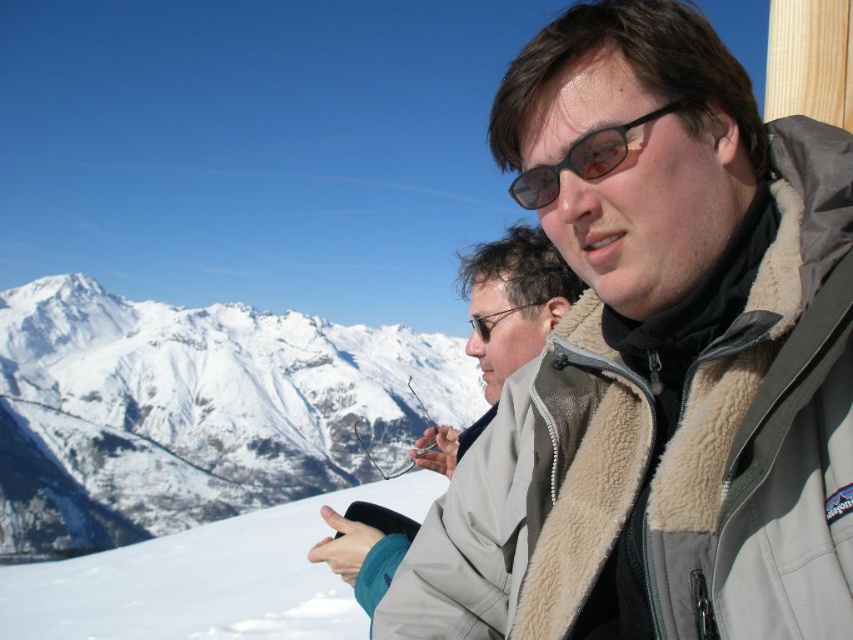
This screenshot has width=853, height=640. I want to click on white snow-covered mountain at upper left, so click(x=193, y=410).

Between point (160, 330) and point (486, 324), which one is positioned in front?

Point (486, 324) is in front.

Measure the distance between point [373,419] and camera.

They are 737.90 feet apart.

Find the location of a particular element. The width and height of the screenshot is (853, 640). white snow-covered mountain at upper left is located at coordinates (193, 410).

Which is in front, point (502, 282) or point (546, 196)?

Positioned in front is point (546, 196).

Can you confirm if light beige jacket at center is smaller than sunglasses at center?

Actually, light beige jacket at center might be larger than sunglasses at center.

Where is `light beige jacket at center`? The width and height of the screenshot is (853, 640). light beige jacket at center is located at coordinates (502, 324).

Between point (57, 598) and point (590, 147), which one is positioned behind?

Positioned behind is point (57, 598).

Can you confirm if white fluffy snow at lower left is shorter than sunglasses at center?

In fact, white fluffy snow at lower left may be taller than sunglasses at center.

At what (x,y) coordinates should I click in order to perform the action: click on white fluffy snow at lower left. Please return your answer as a coordinate pair (x, y). Looking at the image, I should click on (206, 579).

Find the location of a particular element. white fluffy snow at lower left is located at coordinates (206, 579).